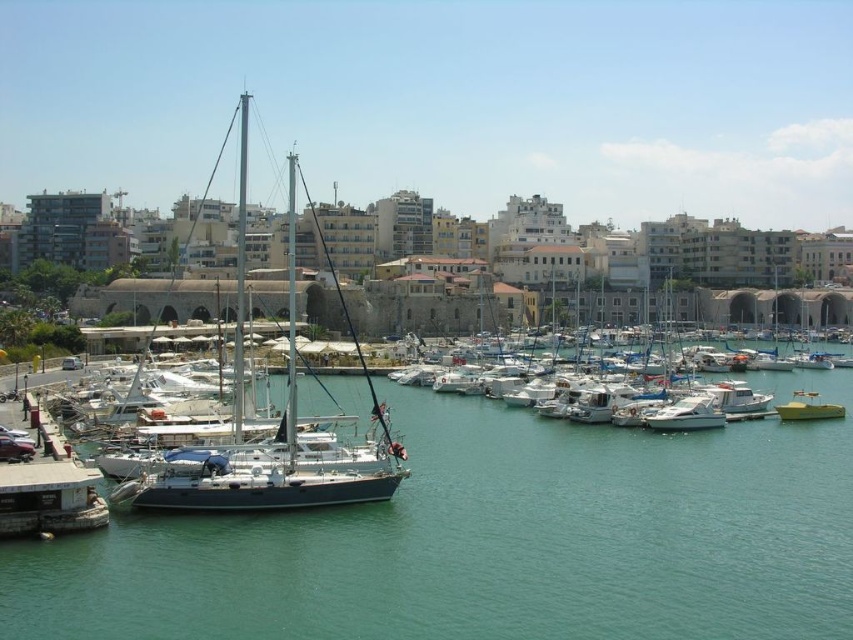
Which is above, white glossy boat at center or green matte boat at center?

Positioned higher is green matte boat at center.

Based on the photo, who is shorter, white glossy boat at center or green matte boat at center?

green matte boat at center

Identify the location of white glossy boat at center. (688, 413).

At what (x,y) coordinates should I click in order to perform the action: click on white glossy boat at center. Please return your answer as a coordinate pair (x, y). Looking at the image, I should click on (688, 413).

Is teal water at center above white glossy boat at center?

No.

Is the position of teal water at center more distant than that of white glossy boat at center?

No, teal water at center is closer to the viewer.

I want to click on teal water at center, so click(x=492, y=540).

Who is higher up, white matte boat at center or green matte boat at center?

white matte boat at center is above.

Can you confirm if white matte boat at center is wider than green matte boat at center?

Correct, the width of white matte boat at center exceeds that of green matte boat at center.

Which is in front, point (816, 320) or point (834, 410)?

Point (834, 410) is in front.

Find the location of `white matte boat at center`. white matte boat at center is located at coordinates (689, 308).